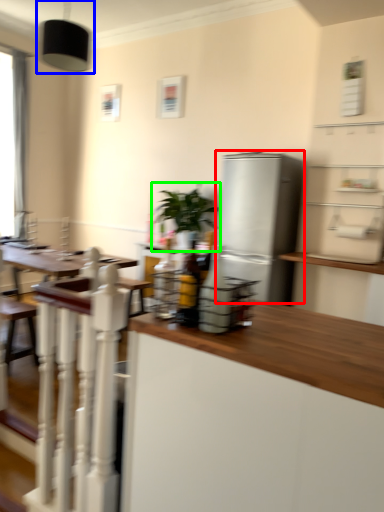
Question: Which object is the farthest from refrigerator (highlighted by a red box)? Choose among these: light fixture (highlighted by a blue box) or houseplant (highlighted by a green box).

Choices:
 (A) light fixture
 (B) houseplant

Answer: (A)